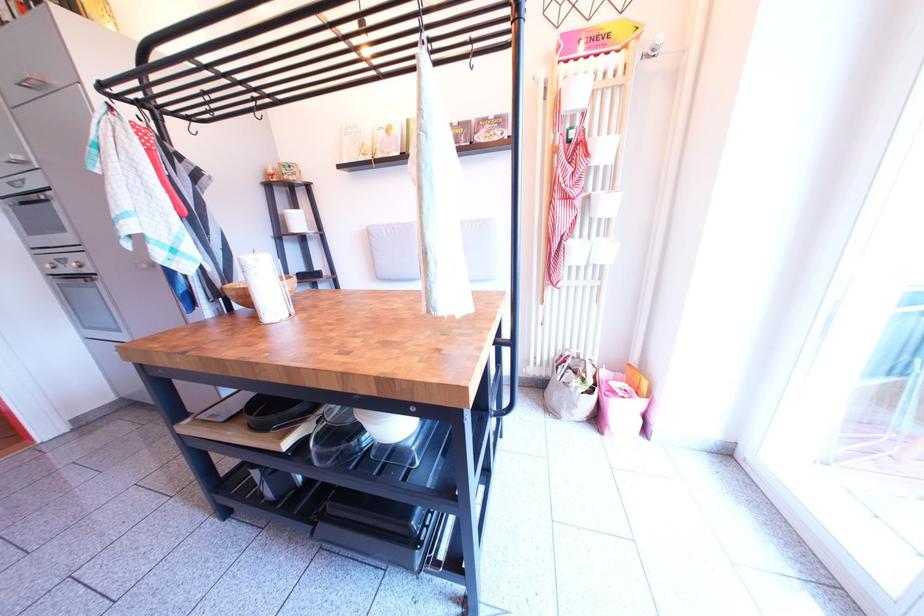
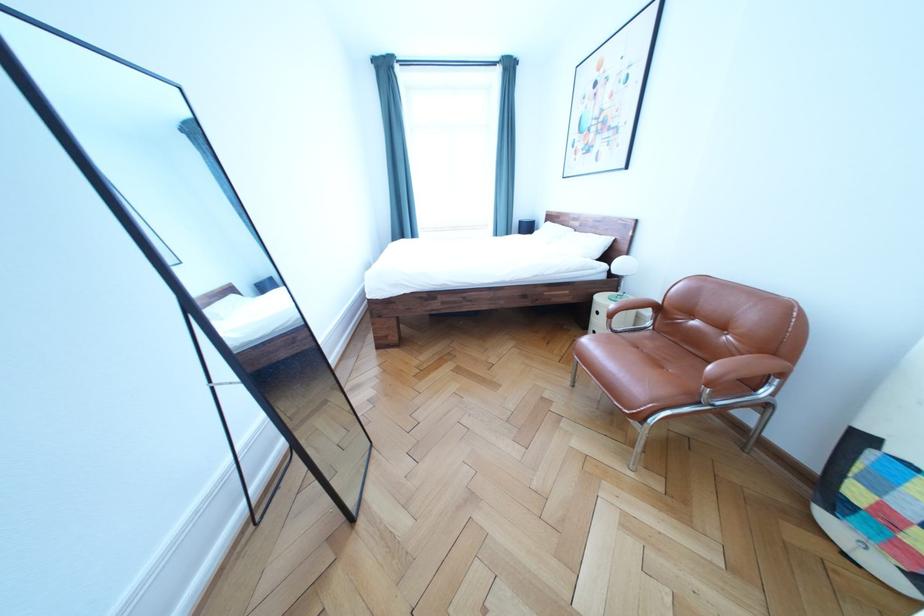
Question: I am providing you with two images of the same scene from different viewpoints. Please identify which objects are invisible in image2.

Choices:
 (A) white pillow
 (B) chair armrest
 (C) jar with yellow lid
 (D) black metal hook

Answer: (D)